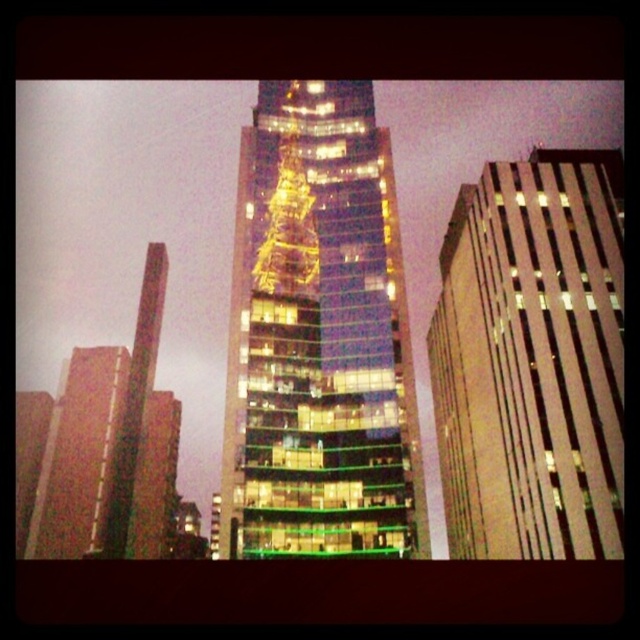
Question: Which is farther from the glass skyscraper at center?

Choices:
 (A) glassy reflective skyscraper at center
 (B) glassy reflective building at right

Answer: (A)

Question: Does glass skyscraper at center lie in front of glassy reflective skyscraper at center?

Choices:
 (A) yes
 (B) no

Answer: (B)

Question: Can you confirm if glassy reflective building at right is wider than glassy skyscraper at left?

Choices:
 (A) yes
 (B) no

Answer: (B)

Question: Which point appears closest to the camera in this image?

Choices:
 (A) (173, 168)
 (B) (97, 448)
 (C) (577, 282)
 (D) (392, 548)

Answer: (D)

Question: Which point is farther to the camera?

Choices:
 (A) glassy reflective building at right
 (B) glassy skyscraper at left
 (C) glass skyscraper at center

Answer: (C)

Question: Can you confirm if glass skyscraper at center is smaller than glassy reflective building at right?

Choices:
 (A) yes
 (B) no

Answer: (B)